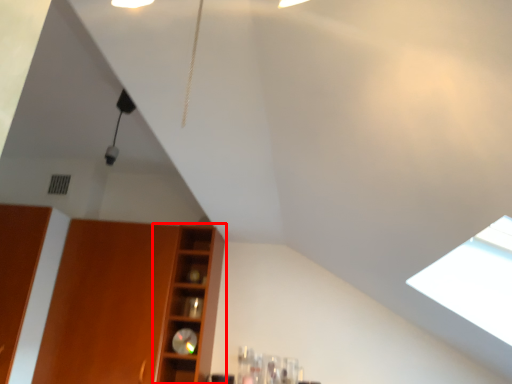
Question: From the image's perspective, where is shelf (annotated by the red box) located relative to cabinetry?

Choices:
 (A) below
 (B) above

Answer: (B)